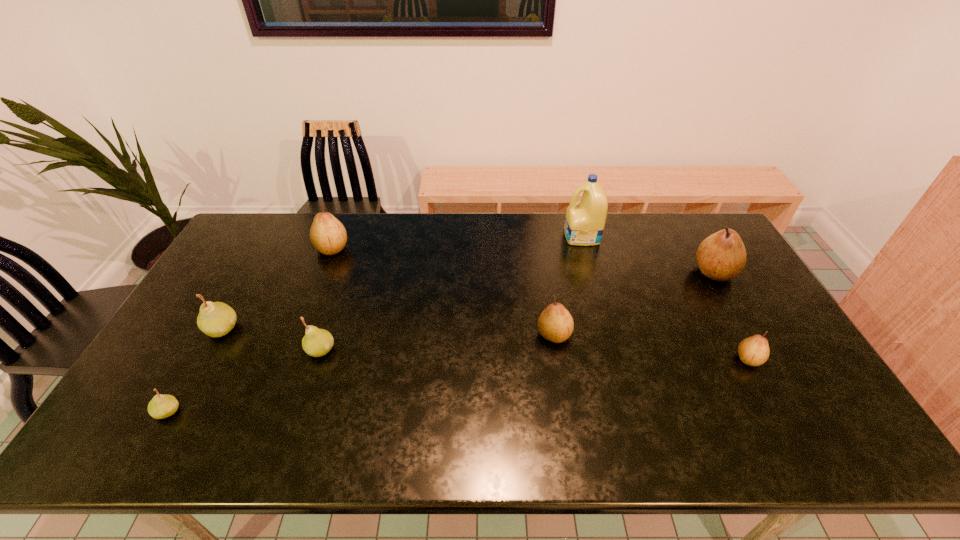
At what (x,y) coordinates should I click in order to perform the action: click on the smallest green pear. Please return your answer as a coordinate pair (x, y). This screenshot has height=540, width=960. Looking at the image, I should click on (161, 406).

This screenshot has width=960, height=540. Find the location of `the smallest brown pear`. the smallest brown pear is located at coordinates (754, 351).

In order to click on free space located on the label of the detergent in this screenshot , I will do pyautogui.click(x=490, y=236).

Locate an element on the screen. Image resolution: width=960 pixels, height=540 pixels. free space located 0.400m on the label of the detergent is located at coordinates (453, 236).

What are the coordinates of `vacant region located 0.250m on the label of the detergent` in the screenshot? It's located at (495, 236).

You are a GUI agent. You are given a task and a screenshot of the screen. Output one action in this format:
    pyautogui.click(x=<x>, y=<y>)
    Task: Click on the free space located on the left of the biggest brown pear
    
    Given the screenshot: What is the action you would take?
    pyautogui.click(x=674, y=272)

Image resolution: width=960 pixels, height=540 pixels. I want to click on free space located on the front of the leftmost brown pear, so click(x=305, y=317).

The height and width of the screenshot is (540, 960). What are the coordinates of `free spot located on the back of the biggest green pear` in the screenshot? It's located at (262, 257).

The image size is (960, 540). I want to click on free spot located on the back of the rightmost green pear, so click(352, 253).

I want to click on vacant space located on the front of the third biggest brown pear, so click(567, 417).